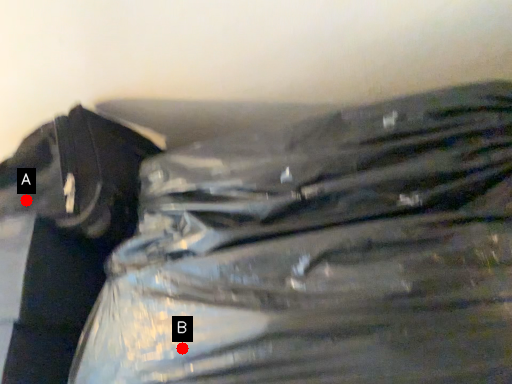
Question: Two points are circled on the image, labeled by A and B beside each circle. Among these points, which one is nearest to the camera?

Choices:
 (A) A is closer
 (B) B is closer

Answer: (B)